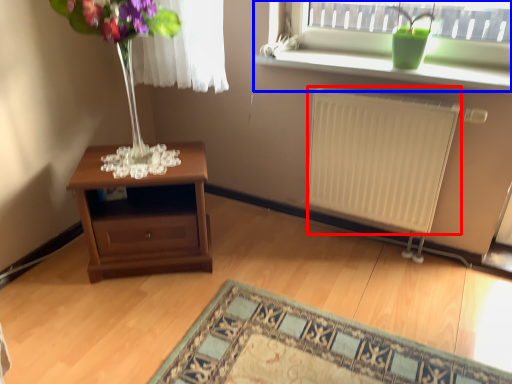
Question: Which of the following is the closest to the observer, radiator (highlighted by a red box) or window (highlighted by a blue box)?

Choices:
 (A) radiator
 (B) window

Answer: (A)